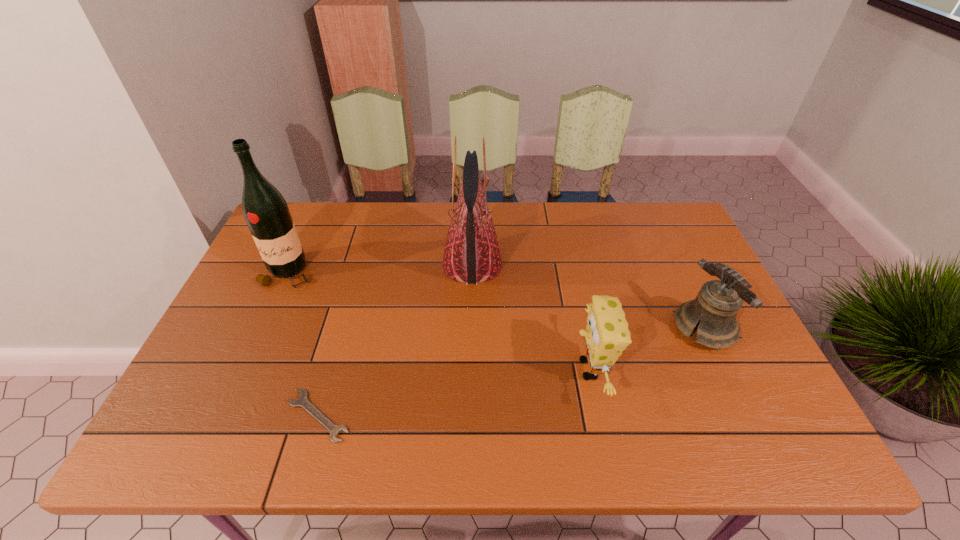
Identify the location of wine bottle. (265, 210).

Find the location of a particular element. This screenshot has height=540, width=960. handbag is located at coordinates pos(471,255).

Find the location of a particular element. The image size is (960, 540). the rightmost object is located at coordinates (718, 302).

Where is `the fourth object from left to right`? The width and height of the screenshot is (960, 540). the fourth object from left to right is located at coordinates (606, 335).

Identify the location of the shortest object. (302, 401).

Locate an element on the screen. The height and width of the screenshot is (540, 960). wrench is located at coordinates (302, 401).

Locate an element on the screen. This screenshot has width=960, height=540. vacant space located on the surface of the leftmost object is located at coordinates (233, 395).

Locate an element on the screen. vacant space located 0.200m on the right of the handbag is located at coordinates (568, 265).

Locate an element on the screen. This screenshot has height=540, width=960. vacant area located 0.350m on the back of the bell is located at coordinates (657, 226).

This screenshot has height=540, width=960. In order to click on free location located 0.380m on the face of the second object from right to left in this screenshot , I will do `click(413, 369)`.